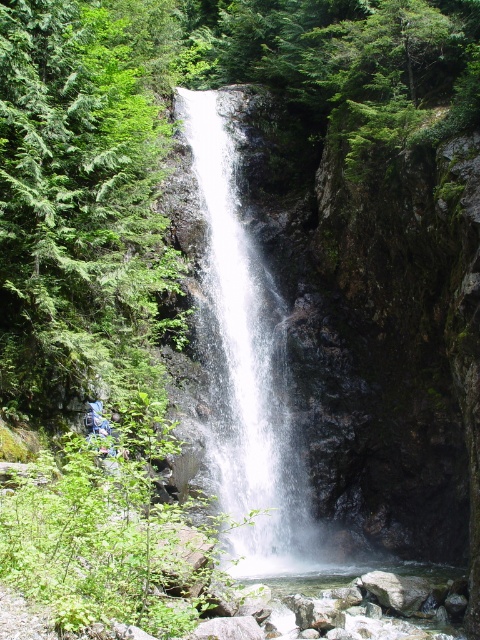
You are a hiker standing at the base of the waterfall. You notice a green textured tree at upper left and white frothy water at center. Which object appears taller from your perspective?

The white frothy water at center appears taller than the green textured tree at upper left because the green textured tree at upper left is shorter than white frothy water at center.

Consider the image. You are a photographer planning to capture the waterfall scene. You notice the green textured tree at upper left and the white frothy water at center. Which of these two objects appears narrower in your photo?

The green textured tree at upper left appears narrower than the white frothy water at center because it has a lesser width compared to it.

You are standing at the base of the waterfall and want to reach the point marked at coordinates point (144, 48). Given that the distance between you and this point is 97.81 feet, is this point located on the same side of the waterfall as you are currently standing?

The point marked at coordinates point (144, 48) is 97.81 feet away from the viewer. Since the distance is quite large, it is likely that the point is located on the opposite side of the waterfall from where the viewer is standing.